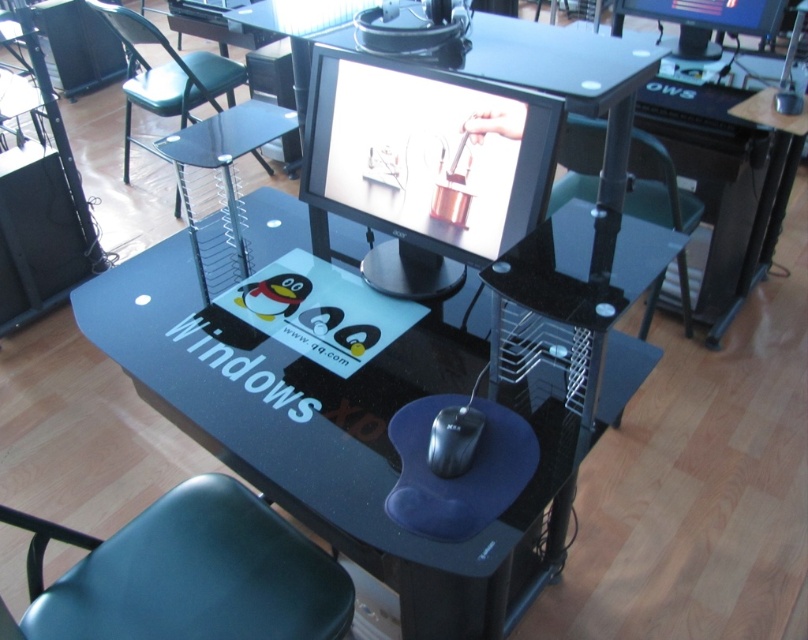
Where is `green plastic chair at upper left`? green plastic chair at upper left is located at coordinates (165, 76).

Is green plastic chair at upper left below black matte mouse at center?

Actually, green plastic chair at upper left is above black matte mouse at center.

This screenshot has height=640, width=808. Describe the element at coordinates (165, 76) in the screenshot. I see `green plastic chair at upper left` at that location.

I want to click on green plastic chair at upper left, so click(x=165, y=76).

Locate an element on the screen. This screenshot has height=640, width=808. transparent glass desk at center is located at coordinates (388, 400).

Is transparent glass desk at center thinner than matte black monitor at upper center?

No, transparent glass desk at center is not thinner than matte black monitor at upper center.

Describe the element at coordinates (388, 400) in the screenshot. I see `transparent glass desk at center` at that location.

This screenshot has height=640, width=808. I want to click on transparent glass desk at center, so click(x=388, y=400).

Identify the location of matte black monitor at center. The height and width of the screenshot is (640, 808). (426, 164).

Does matte black monitor at center lie in front of black matte mouse at center?

No, matte black monitor at center is behind black matte mouse at center.

Between point (388, 225) and point (440, 435), which one is positioned in front?

Point (440, 435) is more forward.

Locate an element on the screen. Image resolution: width=808 pixels, height=640 pixels. matte black monitor at center is located at coordinates (426, 164).